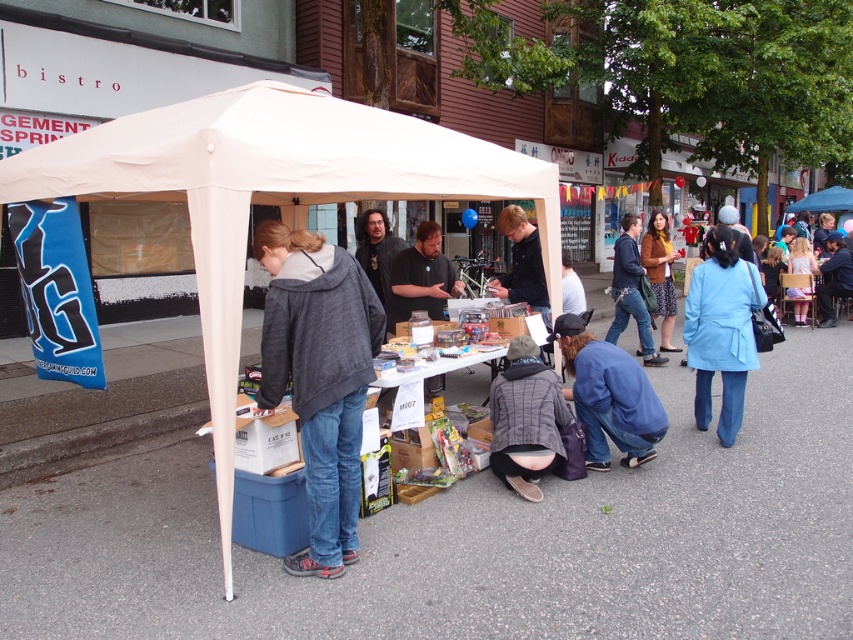
Question: Which object is positioned closest to the brown woolen sweater at upper right?

Choices:
 (A) blue cotton shirt at lower center
 (B) gray textured jacket at lower center
 (C) matte black shirt at center

Answer: (C)

Question: From the image, what is the correct spatial relationship of blue fabric coat at lower right in relation to blue cotton shirt at lower center?

Choices:
 (A) below
 (B) above

Answer: (B)

Question: Which of the following is the farthest from the observer?

Choices:
 (A) blue fabric coat at lower right
 (B) gray textured jacket at lower center
 (C) blue denim jeans at center
 (D) brown woolen sweater at upper right

Answer: (C)

Question: In this image, where is dark gray hoodie at center located relative to blue fabric coat at lower right?

Choices:
 (A) above
 (B) below

Answer: (B)

Question: Does white fabric tent at center have a lesser width compared to dark gray hoodie at center?

Choices:
 (A) yes
 (B) no

Answer: (B)

Question: Which object is positioned farthest from the blue cotton shirt at lower center?

Choices:
 (A) brown woolen sweater at upper right
 (B) matte black shirt at center
 (C) blue fabric coat at lower right

Answer: (A)